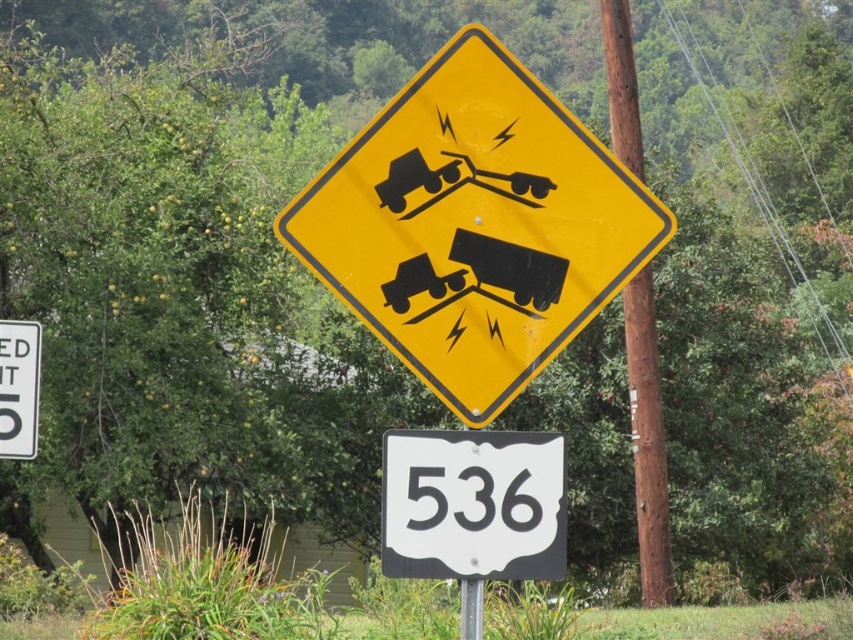
Who is positioned more to the left, brown wooden pole at center-right or white plastic speed limit sign at left?

white plastic speed limit sign at left is more to the left.

Locate an element on the screen. brown wooden pole at center-right is located at coordinates (647, 440).

Who is taller, yellow reflective diamond-shaped warning sign at center or white plastic speed limit sign at left?

Standing taller between the two is yellow reflective diamond-shaped warning sign at center.

Is yellow reflective diamond-shaped warning sign at center positioned in front of white plastic speed limit sign at left?

Yes, it is.

At what (x,y) coordinates should I click in order to perform the action: click on yellow reflective diamond-shaped warning sign at center. Please return your answer as a coordinate pair (x, y). This screenshot has height=640, width=853. Looking at the image, I should click on (474, 225).

Can you confirm if white plastic road sign at center is positioned above metallic pole at center?

Yes.

Where is `white plastic road sign at center`? white plastic road sign at center is located at coordinates (473, 504).